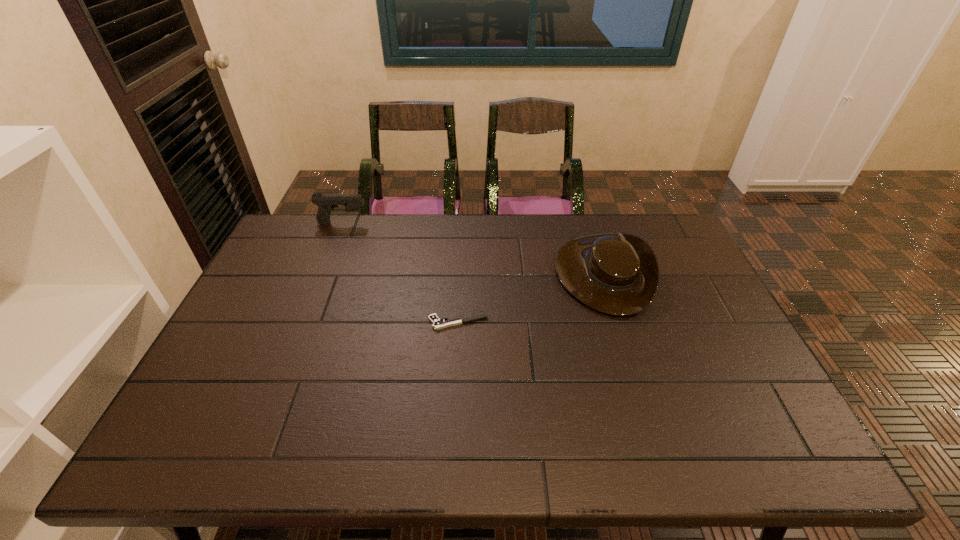
Locate an element on the screen. vacant space located 0.050m on the front-facing side of the shorter pistol is located at coordinates (410, 323).

Image resolution: width=960 pixels, height=540 pixels. In order to click on pistol situated at the far edge in this screenshot , I will do `click(326, 203)`.

You are a GUI agent. You are given a task and a screenshot of the screen. Output one action in this format:
    pyautogui.click(x=<x>, y=<y>)
    Task: Click on the cowboy hat present at the far edge
    
    Given the screenshot: What is the action you would take?
    pyautogui.click(x=617, y=273)

In order to click on object that is at the left edge in this screenshot , I will do `click(326, 203)`.

Locate an element on the screen. object positioned at the far left corner is located at coordinates (326, 203).

The height and width of the screenshot is (540, 960). Identify the location of vacant space at the far edge of the desktop. (341, 231).

At what (x,y) coordinates should I click in order to perform the action: click on free spot at the near edge of the desktop. Please return your answer as a coordinate pair (x, y). The height and width of the screenshot is (540, 960). Looking at the image, I should click on (413, 446).

Find the location of a particular element. This screenshot has height=540, width=960. vacant space at the left edge of the desktop is located at coordinates (254, 293).

What are the coordinates of `blank space at the right edge of the desktop` in the screenshot? It's located at (694, 264).

In the image, there is a desktop. In order to click on blank space at the far left corner in this screenshot , I will do `click(301, 245)`.